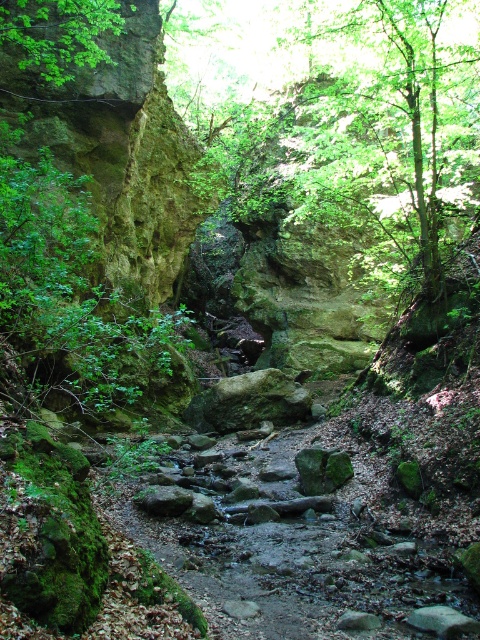
Question: Which of the following is the closest to the observer?

Choices:
 (A) (422, 44)
 (B) (28, 68)

Answer: (A)

Question: From the image, what is the correct spatial relationship of green leafy tree at center in relation to green leafy tree at upper left?

Choices:
 (A) right
 (B) left

Answer: (A)

Question: Among these objects, which one is nearest to the camera?

Choices:
 (A) green leafy tree at center
 (B) green leafy tree at upper left

Answer: (B)

Question: Where is green leafy tree at center located in relation to green leafy tree at upper left in the image?

Choices:
 (A) right
 (B) left

Answer: (A)

Question: Is green leafy tree at center positioned behind green leafy tree at upper left?

Choices:
 (A) yes
 (B) no

Answer: (A)

Question: Which point appears closest to the camera in this image?

Choices:
 (A) (450, 92)
 (B) (96, 8)

Answer: (B)